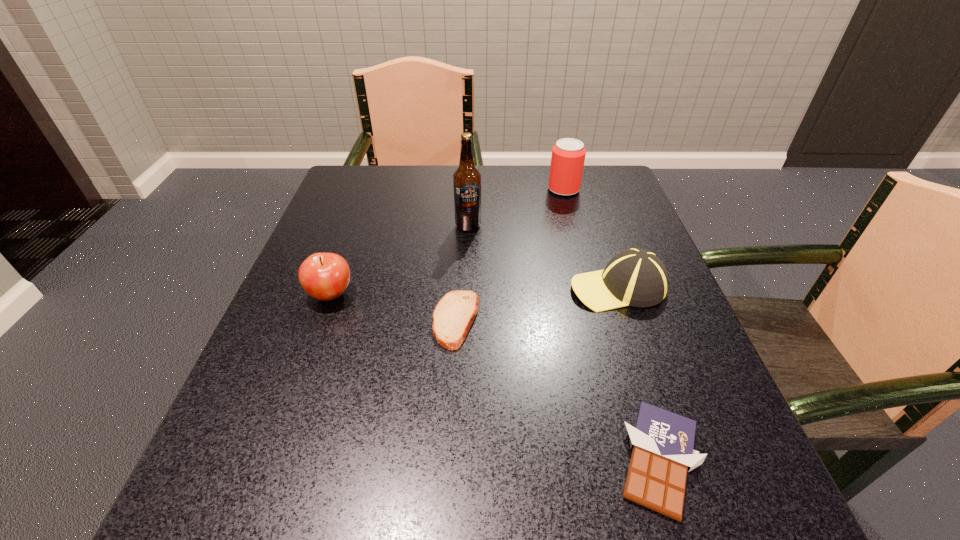
Locate an element on the screen. Image resolution: width=960 pixels, height=540 pixels. baseball cap present at the right edge is located at coordinates (636, 277).

In order to click on chocolate bar that is at the right edge in this screenshot , I will do `click(662, 442)`.

I want to click on object that is positioned at the far right corner, so click(568, 155).

You are a GUI agent. You are given a task and a screenshot of the screen. Output one action in this format:
    pyautogui.click(x=<x>, y=<y>)
    Task: Click on the object that is at the near right corner
    This screenshot has height=540, width=960.
    Given the screenshot: What is the action you would take?
    pyautogui.click(x=662, y=442)

The width and height of the screenshot is (960, 540). In the image, there is a desktop. What are the coordinates of `free space at the far edge` in the screenshot? It's located at (524, 169).

You are a GUI agent. You are given a task and a screenshot of the screen. Output one action in this format:
    pyautogui.click(x=<x>, y=<y>)
    Task: Click on the vacant space at the left edge
    This screenshot has width=960, height=540.
    Given the screenshot: What is the action you would take?
    pyautogui.click(x=381, y=225)

Where is `free space at the right edge of the desktop`? This screenshot has width=960, height=540. free space at the right edge of the desktop is located at coordinates (616, 237).

Where is `free region at the far left corner`? free region at the far left corner is located at coordinates (386, 179).

Identify the location of blank area at the near left corner. The image size is (960, 540). (194, 515).

Locate an element on the screen. The height and width of the screenshot is (540, 960). free region at the near right corner of the desktop is located at coordinates (739, 539).